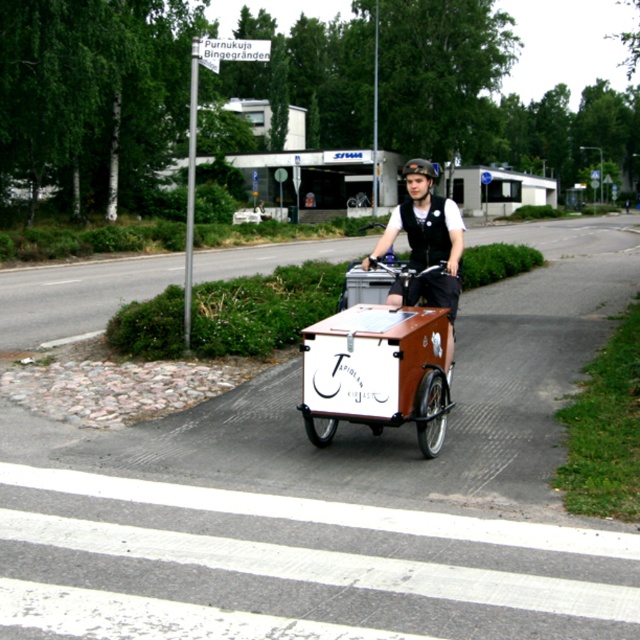
Question: Which point is closer to the camera taking this photo?

Choices:
 (A) (440, 230)
 (B) (403, 272)

Answer: (B)

Question: Does brown matte cargo bike at center have a greater width compared to matte black vest at center?

Choices:
 (A) yes
 (B) no

Answer: (A)

Question: Which point is farther to the camera?

Choices:
 (A) matte black vest at center
 (B) brown matte cargo bike at center

Answer: (A)

Question: Does brown matte cargo bike at center appear on the left side of matte black vest at center?

Choices:
 (A) yes
 (B) no

Answer: (A)

Question: Does brown matte cargo bike at center appear on the left side of matte black vest at center?

Choices:
 (A) no
 (B) yes

Answer: (B)